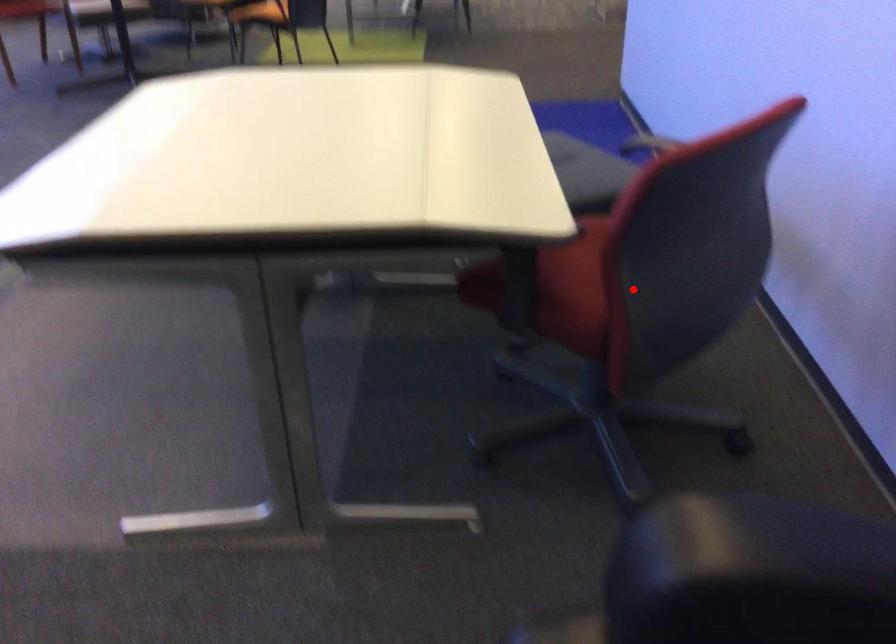
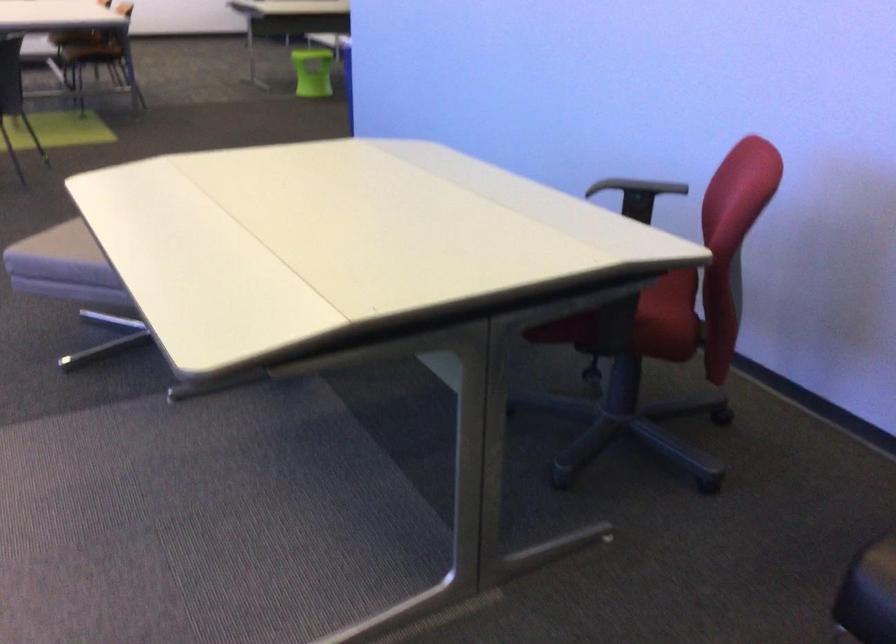
Question: I am providing you with two images of the same scene from different viewpoints. A red point is marked on the first image. Is the red point's position out of view in image 2?

Choices:
 (A) Yes
 (B) No

Answer: (B)